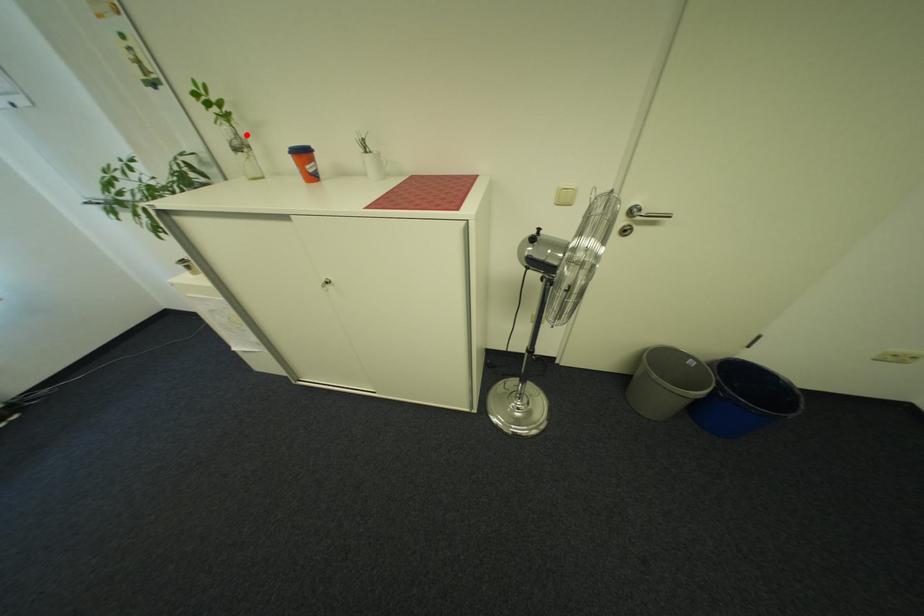
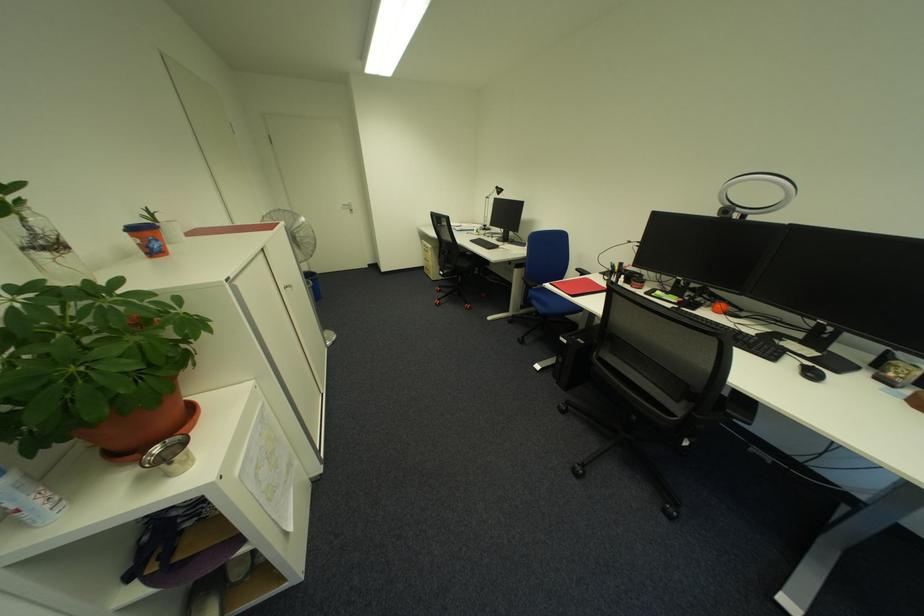
Locate, in the second image, the point that corresponds to the highlighted location in the first image.

(40, 230)